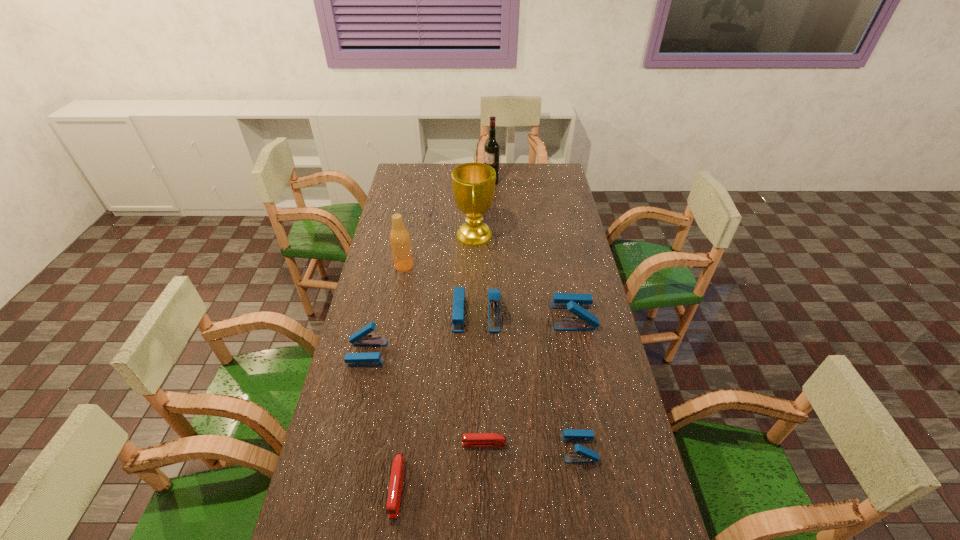
This screenshot has height=540, width=960. In order to click on beer bottle present at the left edge in this screenshot , I will do `click(400, 241)`.

Find the location of a particular element. stapler situated at the left edge is located at coordinates (360, 338).

Where is `free space at the left edge of the desktop`? This screenshot has height=540, width=960. free space at the left edge of the desktop is located at coordinates (368, 305).

This screenshot has width=960, height=540. What are the coordinates of `vacant point at the right edge` in the screenshot? It's located at point(561,339).

Locate an element on the screen. blank space at the far right corner is located at coordinates (542, 178).

You are a GUI agent. You are given a task and a screenshot of the screen. Output one action in this format:
    pyautogui.click(x=<x>, y=<y>)
    Task: Click on the vacant space that is in between the bigger red stapler and the leftmost stapler
    The width and height of the screenshot is (960, 540).
    Given the screenshot: What is the action you would take?
    pyautogui.click(x=382, y=420)

Locate an element on the screen. free space between the leftmost stapler and the beer bottle is located at coordinates (385, 309).

This screenshot has width=960, height=540. I want to click on vacant point located between the farther red stapler and the award, so click(479, 339).

Locate an element on the screen. The image size is (960, 540). free space between the biggest blue stapler and the fourth shortest stapler is located at coordinates (421, 333).

Find the location of `empty location between the seventh shortest object and the shortest object`. empty location between the seventh shortest object and the shortest object is located at coordinates (444, 355).